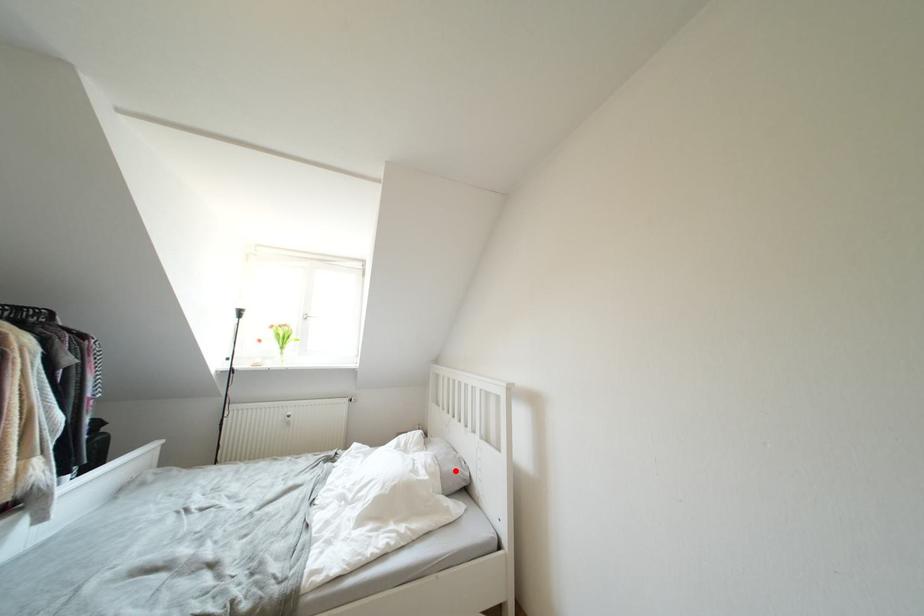
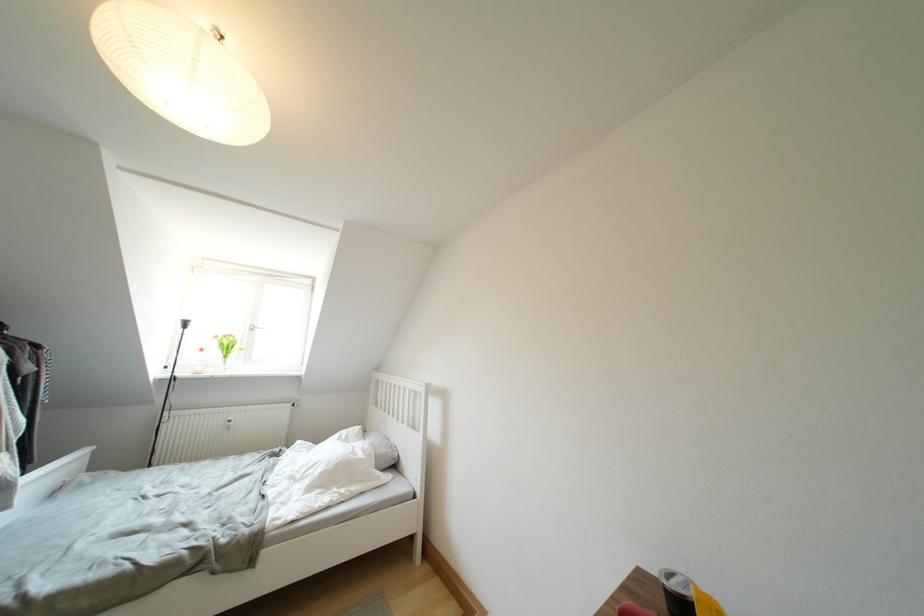
Question: I am providing you with two images of the same scene from different viewpoints. A red point is shown in image1. For the corresponding object point in image2, is it positioned nearer or farther from the camera?

Choices:
 (A) Nearer
 (B) Farther

Answer: (B)